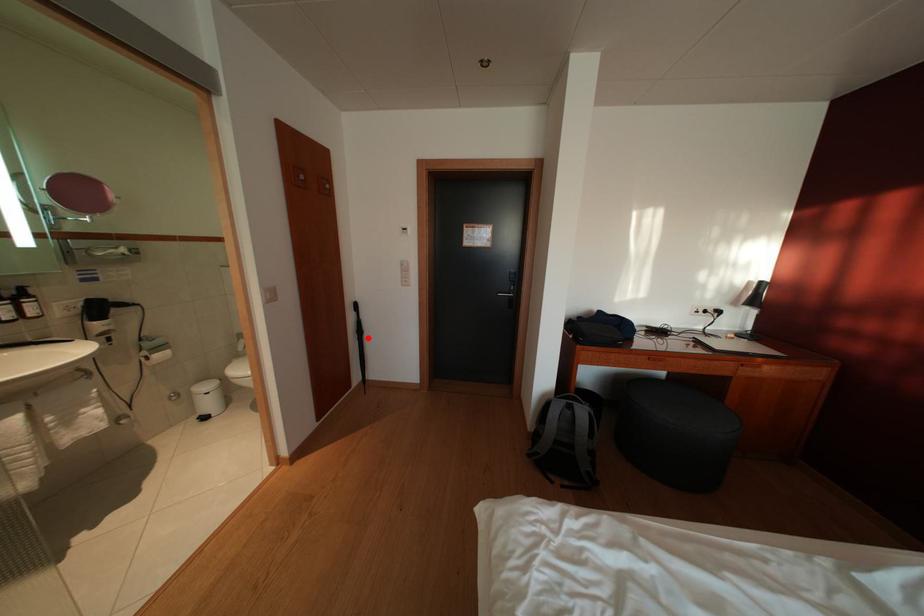
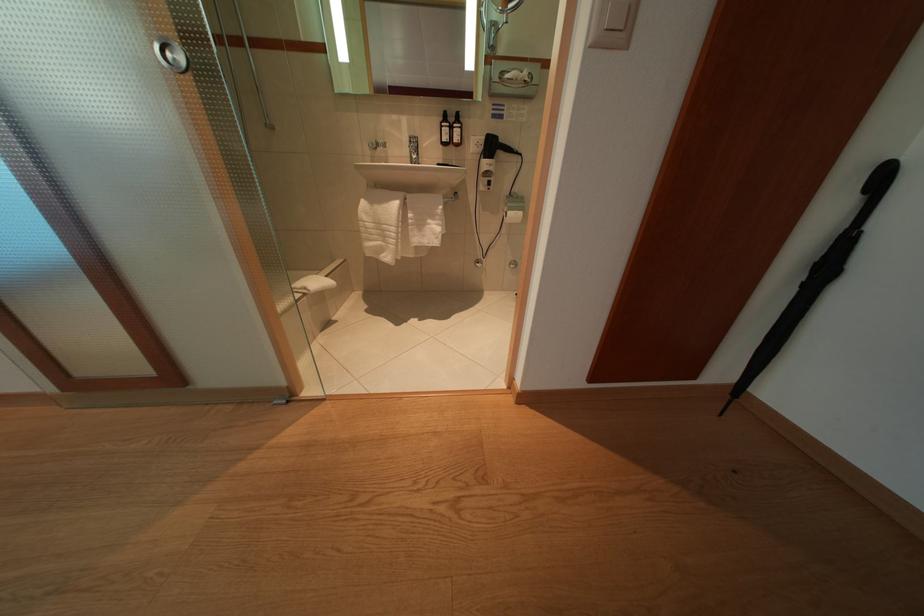
Question: I am providing you with two images of the same scene from different viewpoints. A red point is shown in image1. For the corresponding object point in image2, is it positioned nearer or farther from the camera?

Choices:
 (A) Nearer
 (B) Farther

Answer: (B)